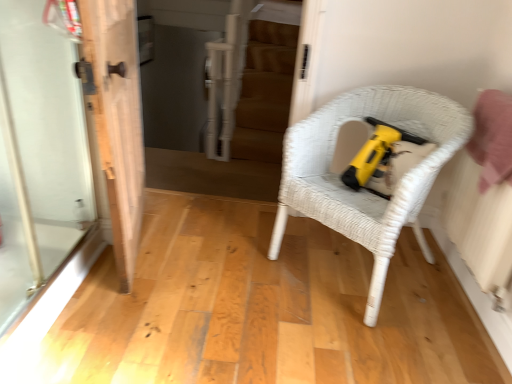
Question: From their relative heights in the image, would you say transparent glass screen door at left is taller or shorter than white wicker chair at center?

Choices:
 (A) short
 (B) tall

Answer: (B)

Question: Looking at the image, does transparent glass screen door at left seem bigger or smaller compared to white wicker chair at center?

Choices:
 (A) small
 (B) big

Answer: (A)

Question: Based on their relative distances, which object is farther from the white wicker chair at center?

Choices:
 (A) white wood door at left
 (B) transparent glass screen door at left

Answer: (B)

Question: Which object is the farthest from the white wicker chair at center?

Choices:
 (A) white wood door at left
 (B) transparent glass screen door at left

Answer: (B)